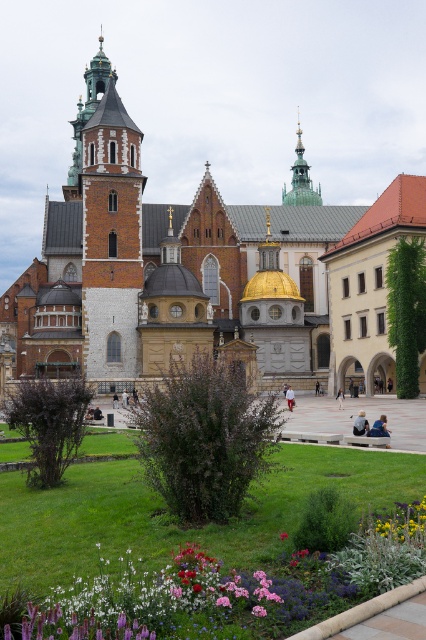
Question: Does green metallic spire at upper center appear on the left side of light blue denim jacket at center?

Choices:
 (A) no
 (B) yes

Answer: (A)

Question: Which point is closer to the camera taking this photo?

Choices:
 (A) (54, 552)
 (B) (365, 532)

Answer: (B)

Question: Estimate the real-world distances between objects in this image. Which object is farther from the brown stone building at center?

Choices:
 (A) multicolored flower bed at center
 (B) yellow-green textured flower at lower right
 (C) pink matte flower at center
 (D) green metallic spire at upper center

Answer: (C)

Question: Estimate the real-world distances between objects in this image. Which object is farther from the light blue denim jacket at center?

Choices:
 (A) smooth pink petal at center
 (B) yellow-green textured flower at lower right
 (C) brown stone building at center

Answer: (B)

Question: Is multicolored flower bed at center closer to the viewer compared to pink matte flower at center?

Choices:
 (A) yes
 (B) no

Answer: (B)

Question: Can you confirm if light blue denim jacket at center is positioned above smooth pink petal at center?

Choices:
 (A) yes
 (B) no

Answer: (A)